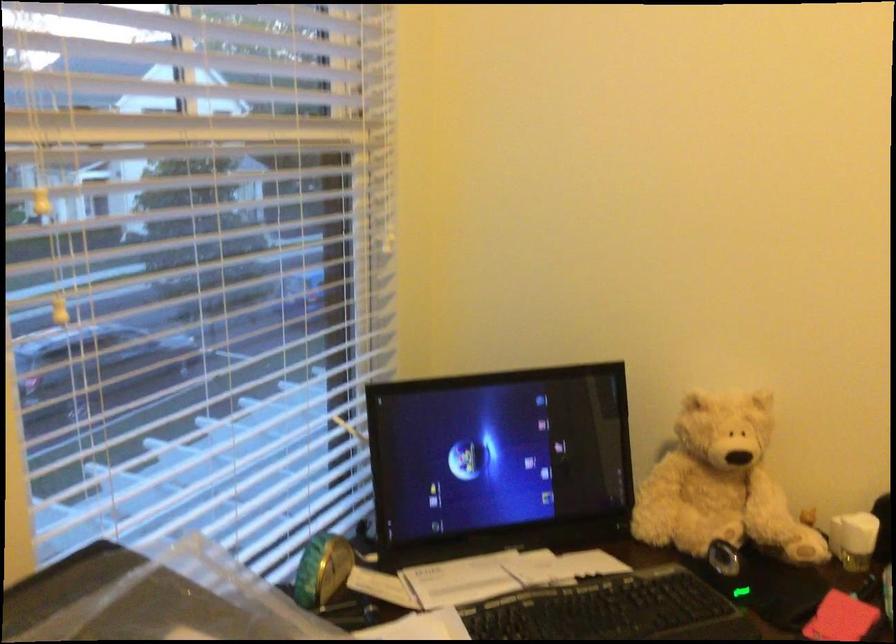
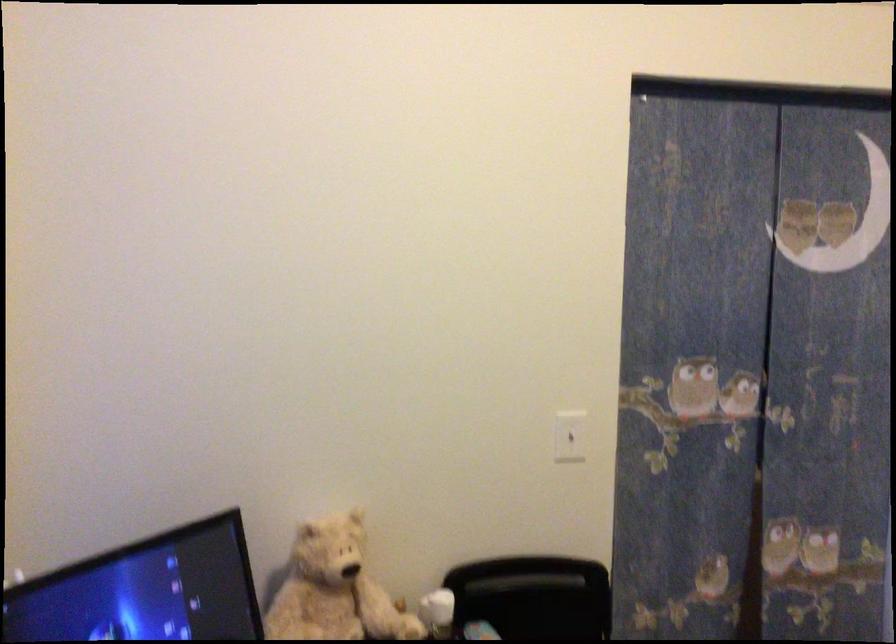
Question: The first image is from the beginning of the video and the second image is from the end. How did the camera likely rotate when shooting the video?

Choices:
 (A) Left
 (B) Right
 (C) Up
 (D) Down

Answer: (B)